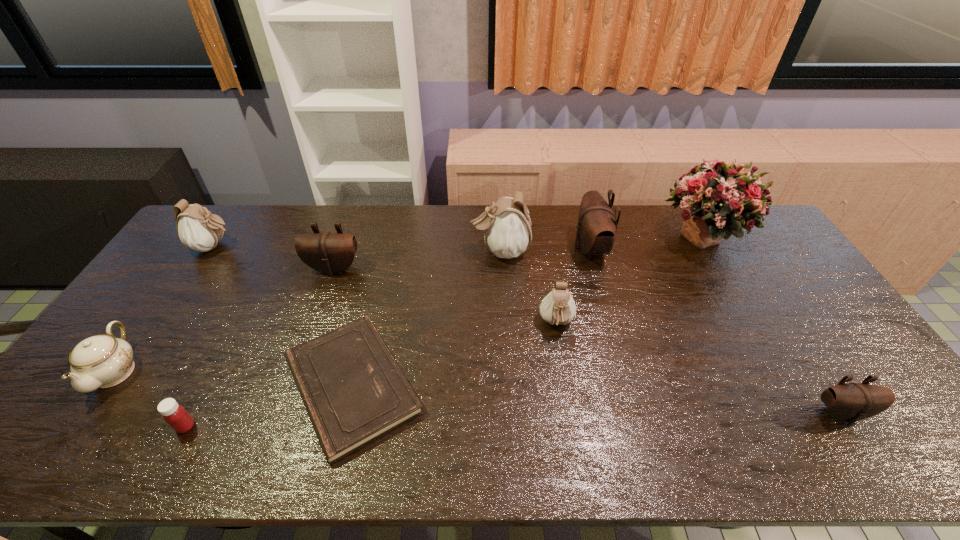
Locate an element on the screen. This screenshot has width=960, height=540. free space located 0.060m on the back of the shortest object is located at coordinates (371, 307).

Identify the location of bouquet that is at the far edge. (718, 198).

At what (x,y) coordinates should I click in order to perform the action: click on medicine that is positioned at the near edge. Please return your answer as a coordinate pair (x, y). The width and height of the screenshot is (960, 540). Looking at the image, I should click on (175, 415).

Identify the location of paperback book positioned at the near edge. The width and height of the screenshot is (960, 540). (354, 392).

Where is `pouch located at the left edge`? The image size is (960, 540). pouch located at the left edge is located at coordinates (197, 228).

At what (x,y) coordinates should I click in order to perform the action: click on chinaware that is at the left edge. Please return your answer as a coordinate pair (x, y). The width and height of the screenshot is (960, 540). Looking at the image, I should click on click(101, 361).

What are the coordinates of `bouquet located at the right edge` in the screenshot? It's located at (718, 198).

The height and width of the screenshot is (540, 960). Identify the location of pouch that is at the right edge. (851, 402).

Where is `object located at the far left corner`? This screenshot has height=540, width=960. object located at the far left corner is located at coordinates (197, 228).

Where is `object located at the far right corner`? object located at the far right corner is located at coordinates (718, 198).